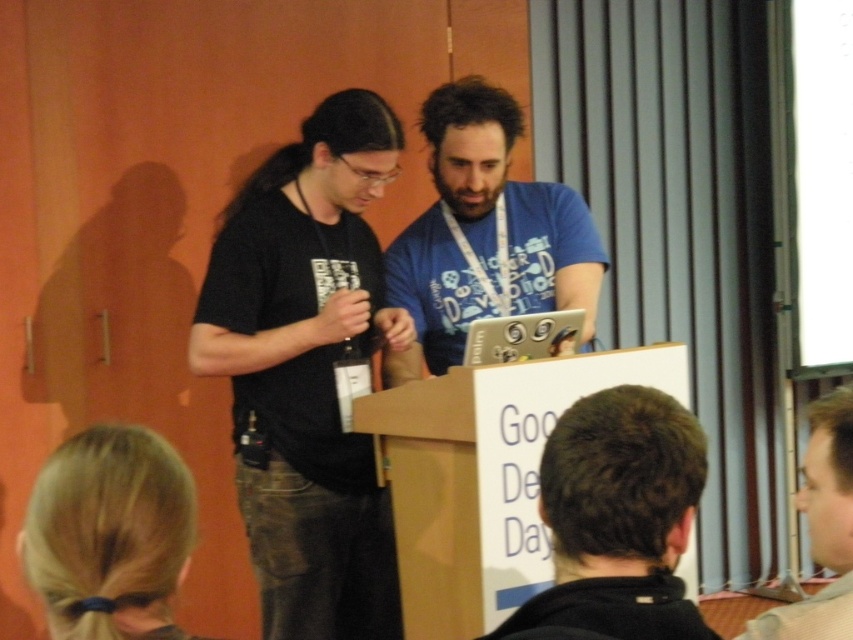
Question: Is brown hair at back below light brown hair at lower right?

Choices:
 (A) yes
 (B) no

Answer: (B)

Question: Can you confirm if blue cotton shirt at center is wider than blonde hair at lower left?

Choices:
 (A) yes
 (B) no

Answer: (A)

Question: Which object is the farthest from the blonde hair at lower left?

Choices:
 (A) blue cotton shirt at center
 (B) black matte t-shirt at left
 (C) light brown hair at lower right

Answer: (A)

Question: Estimate the real-world distances between objects in this image. Which object is closer to the brown hair at back?

Choices:
 (A) light brown hair at lower right
 (B) blonde hair at lower left
 (C) blue cotton shirt at center
 (D) black matte t-shirt at left

Answer: (A)

Question: Estimate the real-world distances between objects in this image. Which object is farther from the blonde hair at lower left?

Choices:
 (A) brown hair at back
 (B) light brown hair at lower right

Answer: (B)

Question: Is the position of black matte t-shirt at left less distant than that of blue cotton shirt at center?

Choices:
 (A) yes
 (B) no

Answer: (A)